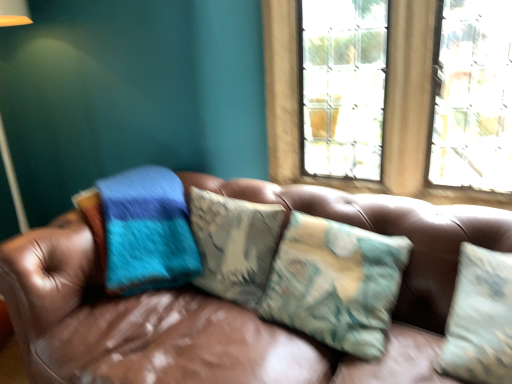
What do you see at coordinates (336, 283) in the screenshot?
I see `camouflage fabric pillow at center` at bounding box center [336, 283].

You are a GUI agent. You are given a task and a screenshot of the screen. Output one action in this format:
    pyautogui.click(x=<x>, y=<y>)
    Task: Click on the clear glass window at upper center
    
    Given the screenshot: What is the action you would take?
    pyautogui.click(x=385, y=110)

Does brown leather couch at center have a greater width compared to camouflage fabric pillow at center?

Yes, brown leather couch at center is wider than camouflage fabric pillow at center.

Considering the sizes of objects brown leather couch at center and camouflage fabric pillow at center in the image provided, who is bigger, brown leather couch at center or camouflage fabric pillow at center?

With larger size is brown leather couch at center.

What's the angular difference between brown leather couch at center and camouflage fabric pillow at center's facing directions?

They differ by 6.21 degrees in their facing directions.

Are brown leather couch at center and camouflage fabric pillow at center located far from each other?

No, there isn't a large distance between brown leather couch at center and camouflage fabric pillow at center.

Can you confirm if clear glass window at upper center is thinner than camouflage fabric pillow at center?

Yes, clear glass window at upper center is thinner than camouflage fabric pillow at center.

Which of these two, clear glass window at upper center or camouflage fabric pillow at center, is bigger?

clear glass window at upper center.

Considering the relative sizes of clear glass window at upper center and camouflage fabric pillow at center in the image provided, is clear glass window at upper center taller than camouflage fabric pillow at center?

Correct, clear glass window at upper center is much taller as camouflage fabric pillow at center.

Which object is further away from the camera, clear glass window at upper center or camouflage fabric pillow at center?

clear glass window at upper center is more distant.

Does clear glass window at upper center touch brown leather couch at center?

No, clear glass window at upper center is not in contact with brown leather couch at center.

Is clear glass window at upper center surrounding brown leather couch at center?

Actually, brown leather couch at center is outside clear glass window at upper center.

Locate an element on the screen. Image resolution: width=512 pixels, height=384 pixels. window lying above the brown leather couch at center (from the image's perspective) is located at coordinates (385, 110).

Considering the relative sizes of clear glass window at upper center and brown leather couch at center in the image provided, is clear glass window at upper center taller than brown leather couch at center?

Indeed, clear glass window at upper center has a greater height compared to brown leather couch at center.

In the scene shown: Considering the positions of objects brown leather couch at center and clear glass window at upper center in the image provided, who is more to the left, brown leather couch at center or clear glass window at upper center?

From the viewer's perspective, brown leather couch at center appears more on the left side.

From a real-world perspective, which is physically above, brown leather couch at center or clear glass window at upper center?

Answer: From a 3D spatial view, clear glass window at upper center is above.

Which object is thinner, brown leather couch at center or clear glass window at upper center?

With smaller width is clear glass window at upper center.

The image size is (512, 384). I want to click on pillow on the right of brown leather couch at center, so click(336, 283).

Who is bigger, camouflage fabric pillow at center or brown leather couch at center?

Bigger between the two is brown leather couch at center.

How different are the orientations of camouflage fabric pillow at center and brown leather couch at center in degrees?

They differ by 6.21 degrees in their facing directions.

From the image's perspective, is camouflage fabric pillow at center over brown leather couch at center?

Yes, from the image's perspective, camouflage fabric pillow at center is on top of brown leather couch at center.

Is camouflage fabric pillow at center closer to the viewer compared to clear glass window at upper center?

Yes, the depth of camouflage fabric pillow at center is less than that of clear glass window at upper center.

Is camouflage fabric pillow at center placed right next to clear glass window at upper center?

No, camouflage fabric pillow at center is not making contact with clear glass window at upper center.

In terms of height, does camouflage fabric pillow at center look taller or shorter compared to clear glass window at upper center?

Clearly, camouflage fabric pillow at center is shorter compared to clear glass window at upper center.

How distant is camouflage fabric pillow at center from clear glass window at upper center?

A distance of 27.56 inches exists between camouflage fabric pillow at center and clear glass window at upper center.

This screenshot has height=384, width=512. I want to click on studio couch below the camouflage fabric pillow at center (from the image's perspective), so click(x=140, y=324).

This screenshot has width=512, height=384. I want to click on window above the camouflage fabric pillow at center (from the image's perspective), so click(x=385, y=110).

When comparing their distances from brown leather couch at center, does camouflage fabric pillow at center or clear glass window at upper center seem further?

Among the two, clear glass window at upper center is located further to brown leather couch at center.

Considering their positions, is clear glass window at upper center positioned closer to brown leather couch at center than camouflage fabric pillow at center?

Based on the image, camouflage fabric pillow at center appears to be nearer to brown leather couch at center.

Looking at this image, based on their spatial positions, is camouflage fabric pillow at center or brown leather couch at center closer to clear glass window at upper center?

Based on the image, brown leather couch at center appears to be nearer to clear glass window at upper center.

Looking at this image, estimate the real-world distances between objects in this image. Which object is closer to camouflage fabric pillow at center, clear glass window at upper center or brown leather couch at center?

brown leather couch at center lies closer to camouflage fabric pillow at center than the other object.

Estimate the real-world distances between objects in this image. Which object is further from clear glass window at upper center, brown leather couch at center or camouflage fabric pillow at center?

camouflage fabric pillow at center is further to clear glass window at upper center.

Looking at the image, which one is located further to camouflage fabric pillow at center, brown leather couch at center or clear glass window at upper center?

clear glass window at upper center lies further to camouflage fabric pillow at center than the other object.

The width and height of the screenshot is (512, 384). I want to click on pillow between clear glass window at upper center and brown leather couch at center in the up-down direction, so click(336, 283).